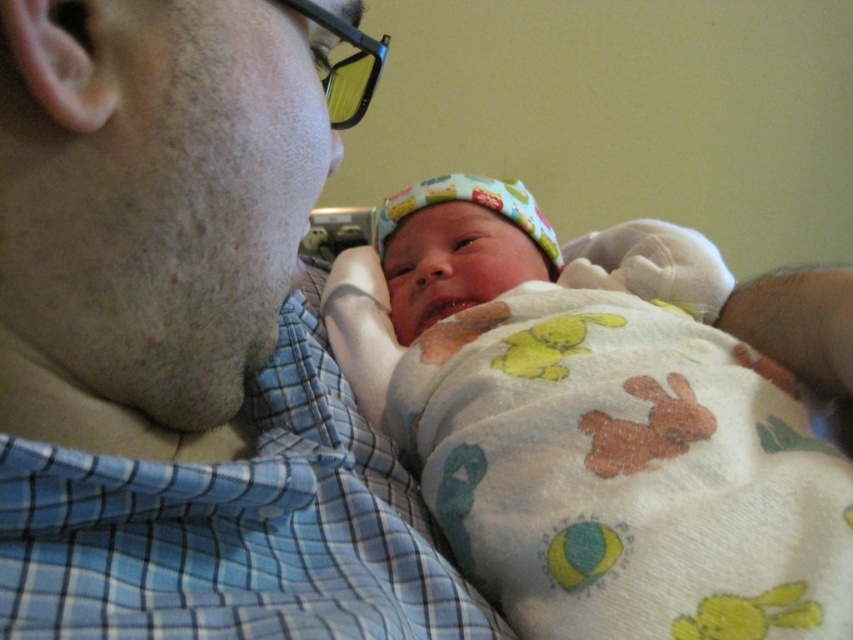
Which is more to the right, blue plaid shirt at upper left or soft cotton blanket at center?

From the viewer's perspective, soft cotton blanket at center appears more on the right side.

Is blue plaid shirt at upper left bigger than soft cotton blanket at center?

No.

Is point (136, 120) more distant than point (346, 339)?

No, (136, 120) is in front of (346, 339).

This screenshot has height=640, width=853. I want to click on blue plaid shirt at upper left, so click(x=189, y=339).